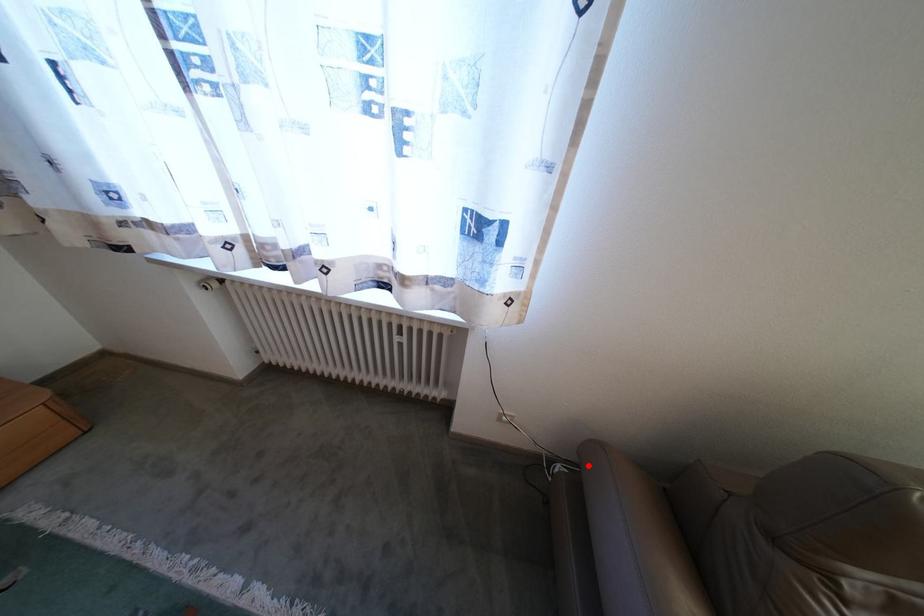
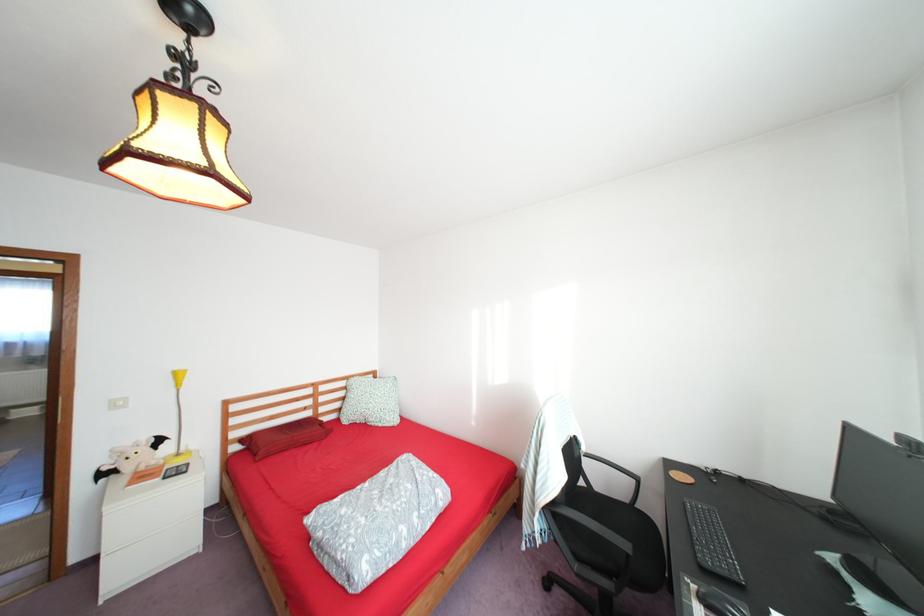
Question: I am providing you with two images of the same scene from different viewpoints. A red point is marked on the first image. Is the red point's position out of view in image 2?

Choices:
 (A) Yes
 (B) No

Answer: (A)